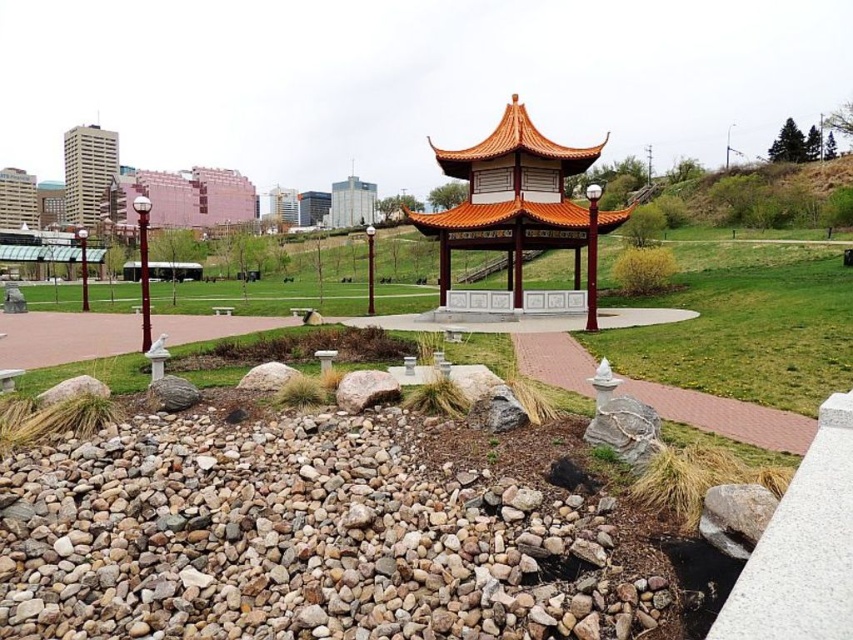
Between gray gravel rocks at lower left and beige concrete tower at upper left, which one has less height?

gray gravel rocks at lower left is shorter.

Can you confirm if gray gravel rocks at lower left is taller than beige concrete tower at upper left?

No.

Measure the distance between gray gravel rocks at lower left and camera.

They are 3.85 meters apart.

Where is `gray gravel rocks at lower left`? gray gravel rocks at lower left is located at coordinates 299,540.

The image size is (853, 640). Describe the element at coordinates (299, 540) in the screenshot. I see `gray gravel rocks at lower left` at that location.

Is gray gravel rocks at lower left behind orange wood gazebo at center?

No, it is not.

The width and height of the screenshot is (853, 640). What do you see at coordinates (299, 540) in the screenshot?
I see `gray gravel rocks at lower left` at bounding box center [299, 540].

Locate an element on the screen. gray gravel rocks at lower left is located at coordinates (299, 540).

Does orange wood gazebo at center have a lesser height compared to beige concrete tower at upper left?

Yes, orange wood gazebo at center is shorter than beige concrete tower at upper left.

Who is positioned more to the right, orange wood gazebo at center or beige concrete tower at upper left?

Positioned to the right is orange wood gazebo at center.

Does point (502, 230) lie in front of point (86, 186)?

Yes, point (502, 230) is closer to viewer.

The image size is (853, 640). I want to click on orange wood gazebo at center, so (517, 214).